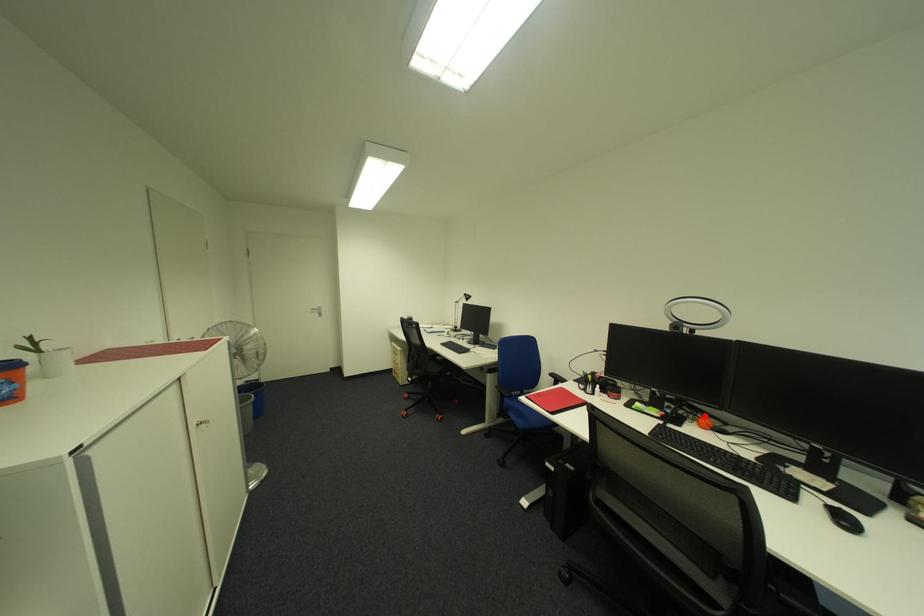
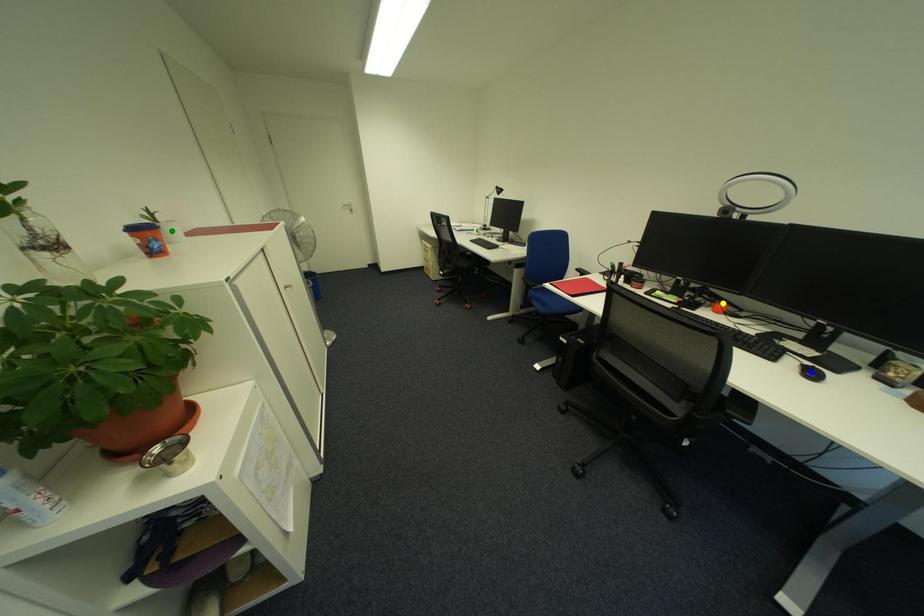
Question: I am providing you with two images of the same scene from different viewpoints. A red point is marked on the first image. You are given multiple points on the second image. Which point in image 2 represents the same 3d spot as the red point in image 1?

Choices:
 (A) green point
 (B) yellow point
 (C) blue point

Answer: (B)